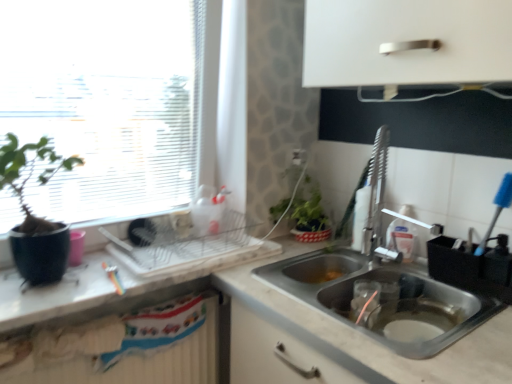
Find the location of a particular element. This screenshot has height=384, width=512. empty space that is ontop of black plastic utensil holder at sink, the first appliance viewed from the right is located at coordinates (469, 242).